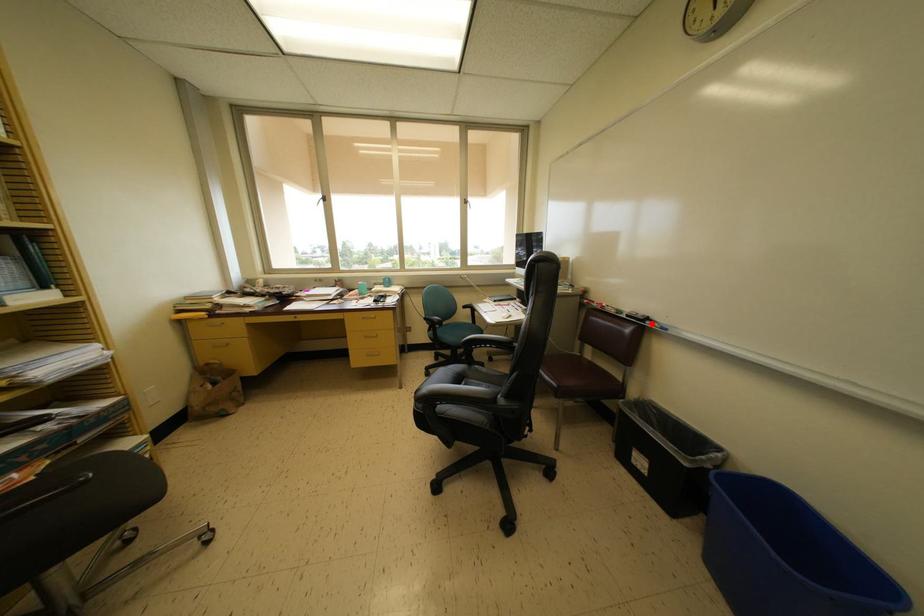
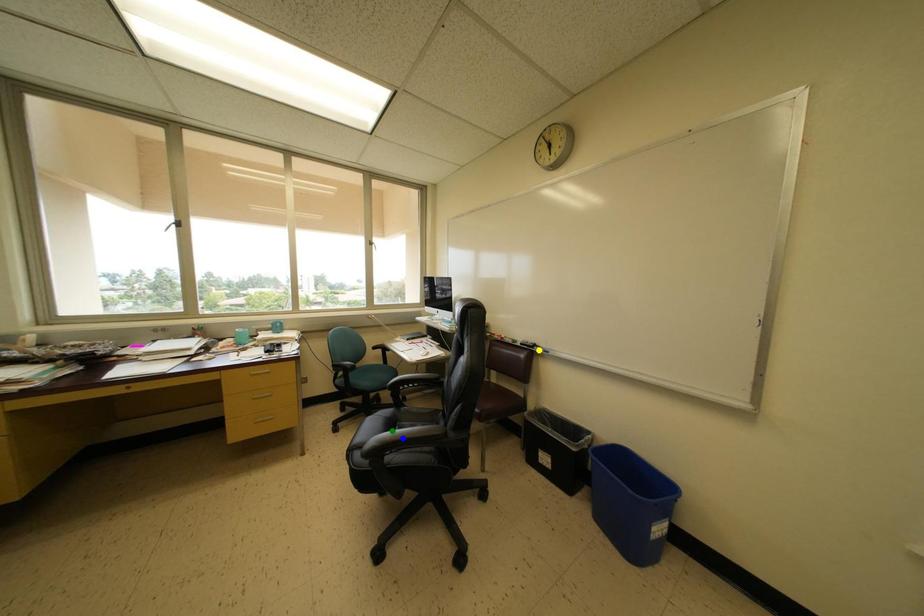
Question: I am providing you with two images of the same scene from different viewpoints. A red point is marked on the first image. You are given multiple points on the second image. In image 2, which mark is for the same physical point as the one in image 1?

Choices:
 (A) yellow point
 (B) green point
 (C) blue point

Answer: (A)